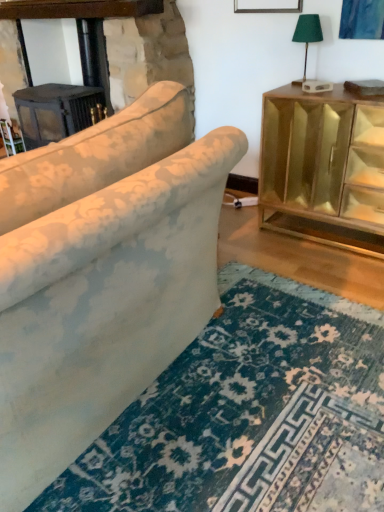
Question: From the image's perspective, would you say gold mirrored cabinet at right is shown under dark gray wood fireplace at upper left?

Choices:
 (A) no
 (B) yes

Answer: (B)

Question: Considering the relative sizes of gold mirrored cabinet at right and dark gray wood fireplace at upper left in the image provided, is gold mirrored cabinet at right smaller than dark gray wood fireplace at upper left?

Choices:
 (A) yes
 (B) no

Answer: (A)

Question: Does gold mirrored cabinet at right come in front of dark gray wood fireplace at upper left?

Choices:
 (A) no
 (B) yes

Answer: (B)

Question: From a real-world perspective, is gold mirrored cabinet at right located beneath dark gray wood fireplace at upper left?

Choices:
 (A) no
 (B) yes

Answer: (B)

Question: Is gold mirrored cabinet at right far away from dark gray wood fireplace at upper left?

Choices:
 (A) yes
 (B) no

Answer: (A)

Question: From the image's perspective, is gold mirrored cabinet at right over dark gray wood fireplace at upper left?

Choices:
 (A) no
 (B) yes

Answer: (A)

Question: From the image's perspective, is green fabric lampshade at upper right on top of gold mirrored cabinet at right?

Choices:
 (A) no
 (B) yes

Answer: (B)

Question: Does green fabric lampshade at upper right appear on the left side of gold mirrored cabinet at right?

Choices:
 (A) yes
 (B) no

Answer: (A)

Question: Is the position of green fabric lampshade at upper right less distant than that of gold mirrored cabinet at right?

Choices:
 (A) no
 (B) yes

Answer: (A)

Question: Is green fabric lampshade at upper right facing away from gold mirrored cabinet at right?

Choices:
 (A) no
 (B) yes

Answer: (A)

Question: Is green fabric lampshade at upper right far from gold mirrored cabinet at right?

Choices:
 (A) no
 (B) yes

Answer: (A)

Question: Is green fabric lampshade at upper right completely or partially outside of gold mirrored cabinet at right?

Choices:
 (A) yes
 (B) no

Answer: (A)

Question: From a real-world perspective, is green fabric lampshade at upper right over dark gray wood fireplace at upper left?

Choices:
 (A) no
 (B) yes

Answer: (B)